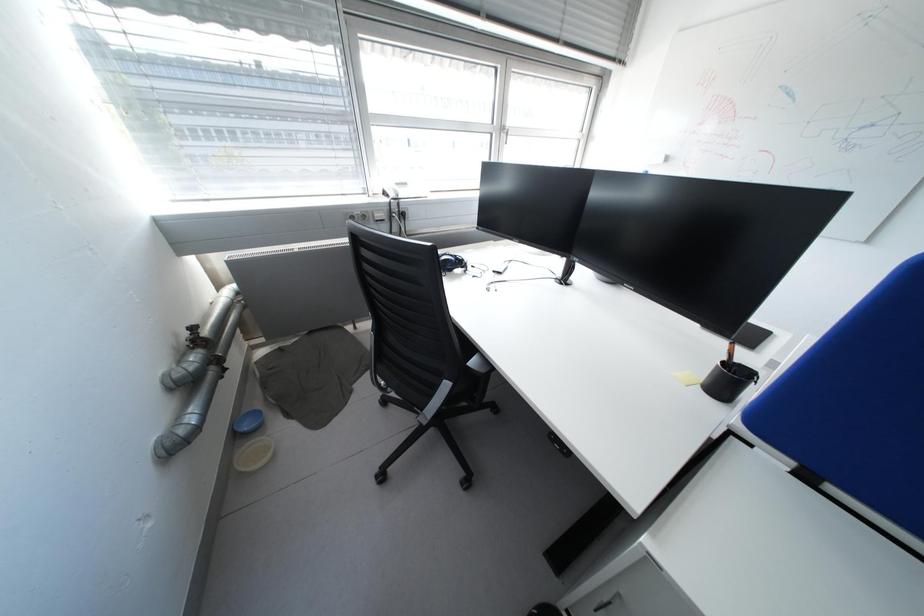
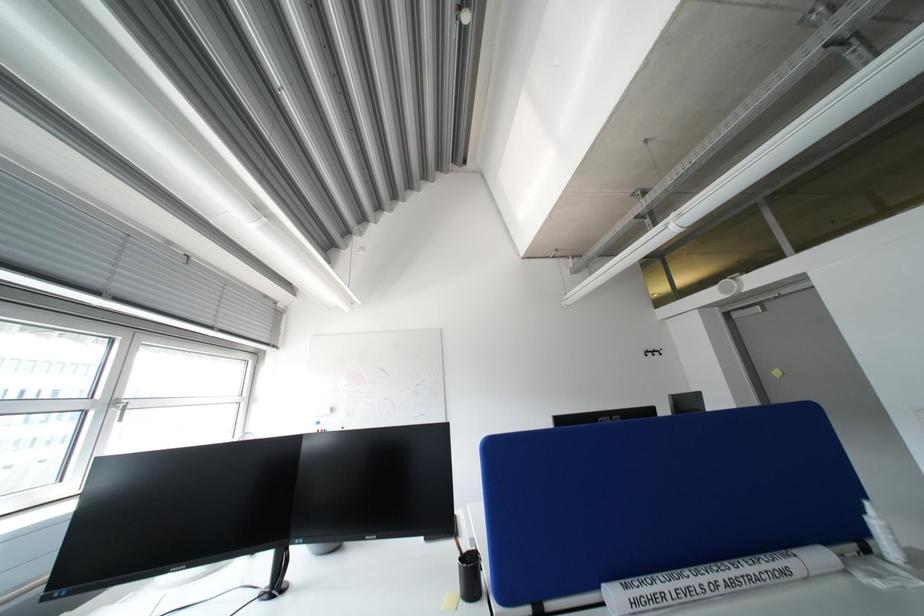
Based on the photo, how did the camera likely rotate?

The rotation direction of the camera is right-up.